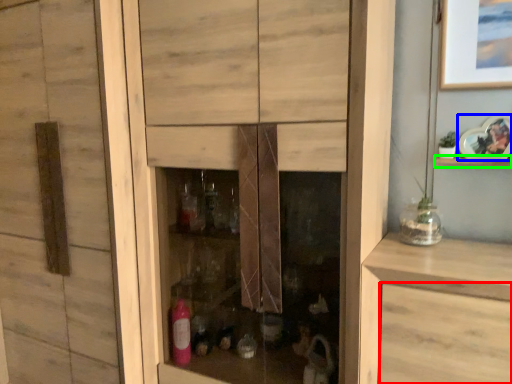
Question: Which is nearer to the drawer (highlighted by a red box)? picture frame (highlighted by a blue box) or shelf (highlighted by a green box).

Choices:
 (A) picture frame
 (B) shelf

Answer: (B)